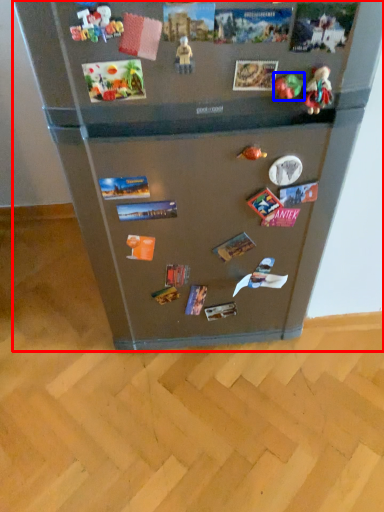
Question: Which point is closer to the camera, refrigerator (highlighted by a red box) or toy (highlighted by a blue box)?

Choices:
 (A) refrigerator
 (B) toy

Answer: (A)